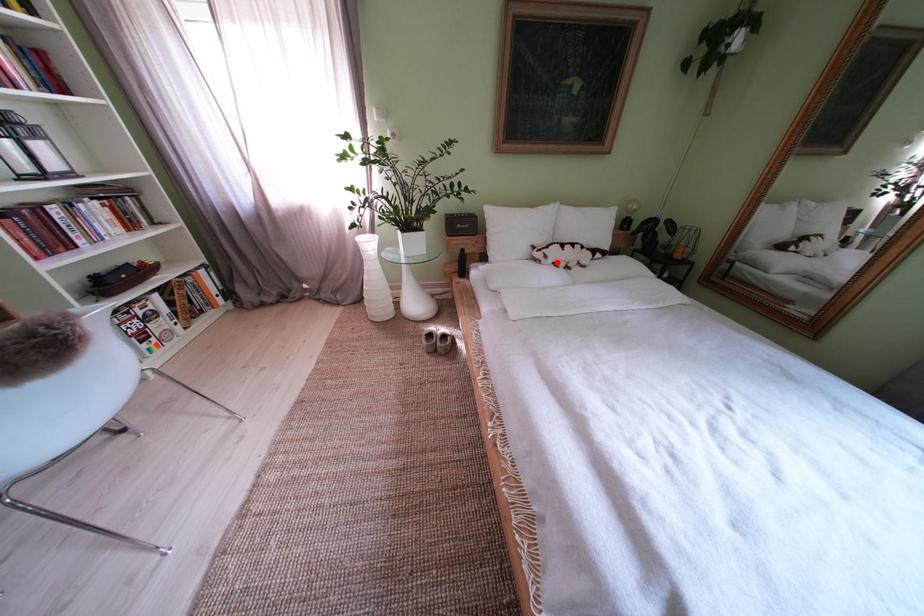
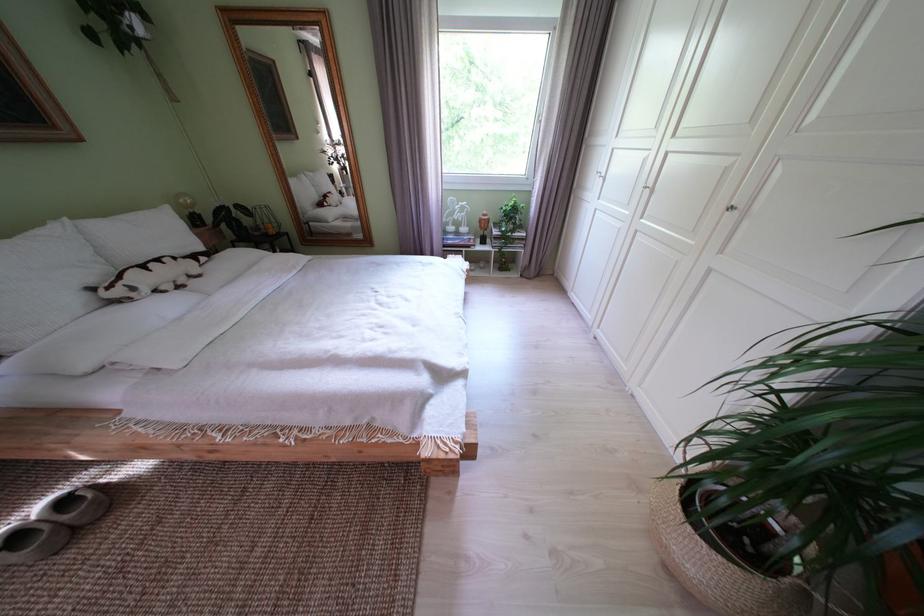
The point at the highlighted location is marked in the first image. Where is the corresponding point in the second image?

(146, 294)